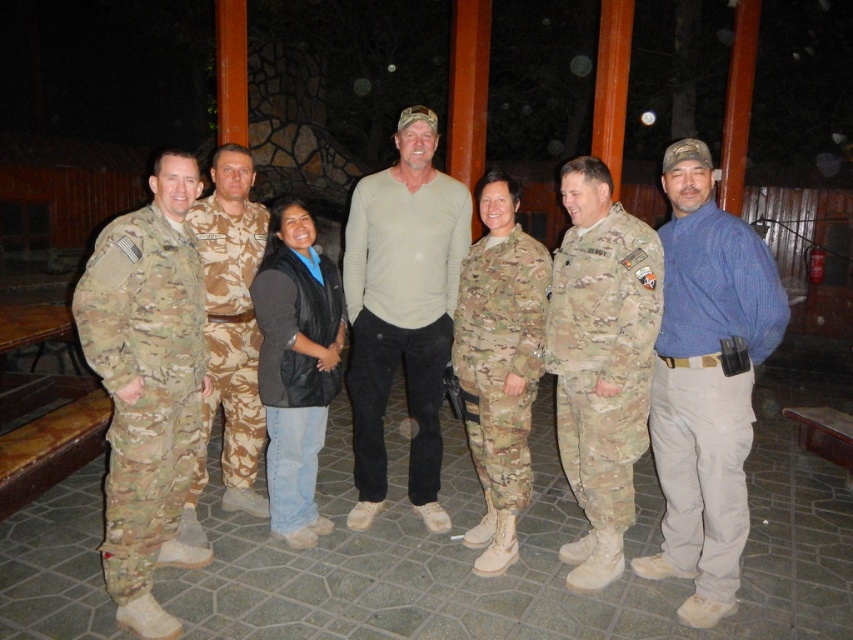
You are a photographer trying to capture a group photo of the beige cotton shirt at center and the camouflage fabric uniform at center. Since you want to ensure both subjects are in focus, you need to know which one is taller. Can you determine which of the two is taller?

The beige cotton shirt at center has a greater height compared to camouflage fabric uniform at center, so the beige cotton shirt at center is taller.

You are a photographer setting up a shot of the group. You need to ensure that the person in the camouflage fabric uniform at left and the person in the beige cotton shirt at center are both in focus. Which person should you adjust your camera focus for first to account for their sizes?

The camouflage fabric uniform at left has a lesser width compared to beige cotton shirt at center, so you should focus on the beige cotton shirt at center first since it is wider and may require more precise focus adjustment.

You are a photographer positioned at the front of the group. You want to take a photo that includes both the camouflage fabric uniform at left and the beige cotton shirt at center. Which of the two clothing items will appear larger in the photo?

The camouflage fabric uniform at left will appear larger in the photo because it is closer to the viewer than the beige cotton shirt at center.